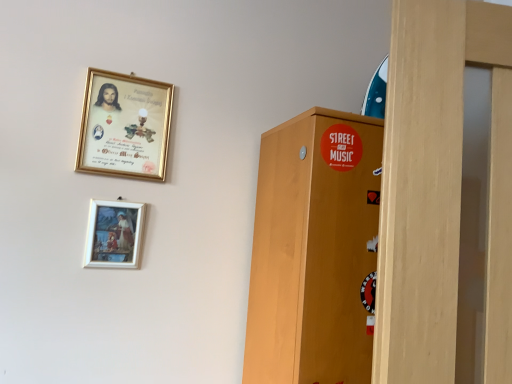
Question: Considering the relative sizes of gold-framed picture at upper left, marked as the first picture frame in a top-to-bottom arrangement, and matte wooden picture frame at lower center, placed as the second picture frame when sorted from top to bottom, in the image provided, is gold-framed picture at upper left, marked as the first picture frame in a top-to-bottom arrangement, wider than matte wooden picture frame at lower center, placed as the second picture frame when sorted from top to bottom,?

Choices:
 (A) yes
 (B) no

Answer: (A)

Question: Is gold-framed picture at upper left, the 2th picture frame in the bottom-to-top sequence, shorter than matte wooden picture frame at lower center, placed as the second picture frame when sorted from top to bottom?

Choices:
 (A) no
 (B) yes

Answer: (A)

Question: Is gold-framed picture at upper left, marked as the first picture frame in a top-to-bottom arrangement, closer to camera compared to matte wooden picture frame at lower center, placed as the second picture frame when sorted from top to bottom?

Choices:
 (A) yes
 (B) no

Answer: (B)

Question: Is gold-framed picture at upper left, marked as the first picture frame in a top-to-bottom arrangement, aimed at matte wooden picture frame at lower center, which ranks as the first picture frame in bottom-to-top order?

Choices:
 (A) no
 (B) yes

Answer: (A)

Question: Does gold-framed picture at upper left, the 2th picture frame in the bottom-to-top sequence, appear on the left side of matte wooden picture frame at lower center, which ranks as the first picture frame in bottom-to-top order?

Choices:
 (A) no
 (B) yes

Answer: (A)

Question: Is gold-framed picture at upper left, marked as the first picture frame in a top-to-bottom arrangement, facing away from matte wooden picture frame at lower center, which ranks as the first picture frame in bottom-to-top order?

Choices:
 (A) no
 (B) yes

Answer: (A)

Question: Is matte wooden picture frame at lower center, placed as the second picture frame when sorted from top to bottom, outside of gold-framed picture at upper left, marked as the first picture frame in a top-to-bottom arrangement?

Choices:
 (A) no
 (B) yes

Answer: (B)

Question: Can you confirm if matte wooden picture frame at lower center, which ranks as the first picture frame in bottom-to-top order, is wider than gold-framed picture at upper left, the 2th picture frame in the bottom-to-top sequence?

Choices:
 (A) no
 (B) yes

Answer: (A)

Question: Is matte wooden picture frame at lower center, placed as the second picture frame when sorted from top to bottom, bigger than gold-framed picture at upper left, marked as the first picture frame in a top-to-bottom arrangement?

Choices:
 (A) yes
 (B) no

Answer: (B)

Question: Is matte wooden picture frame at lower center, which ranks as the first picture frame in bottom-to-top order, further to camera compared to gold-framed picture at upper left, marked as the first picture frame in a top-to-bottom arrangement?

Choices:
 (A) yes
 (B) no

Answer: (B)

Question: Does matte wooden picture frame at lower center, which ranks as the first picture frame in bottom-to-top order, appear on the left side of gold-framed picture at upper left, the 2th picture frame in the bottom-to-top sequence?

Choices:
 (A) no
 (B) yes

Answer: (B)

Question: From a real-world perspective, is matte wooden picture frame at lower center, placed as the second picture frame when sorted from top to bottom, on top of gold-framed picture at upper left, the 2th picture frame in the bottom-to-top sequence?

Choices:
 (A) yes
 (B) no

Answer: (B)

Question: Is matte wooden picture frame at lower center, placed as the second picture frame when sorted from top to bottom, to the left or to the right of gold-framed picture at upper left, the 2th picture frame in the bottom-to-top sequence, in the image?

Choices:
 (A) left
 (B) right

Answer: (A)